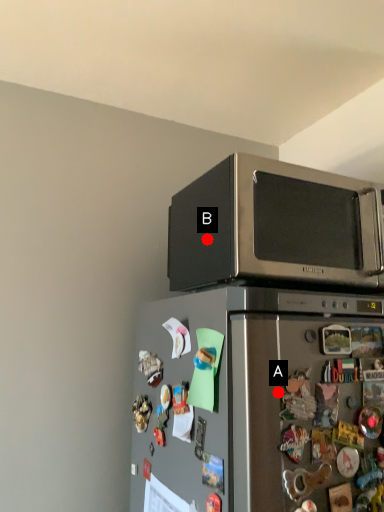
Question: Two points are circled on the image, labeled by A and B beside each circle. Among these points, which one is farthest from the camera?

Choices:
 (A) A is further
 (B) B is further

Answer: (B)